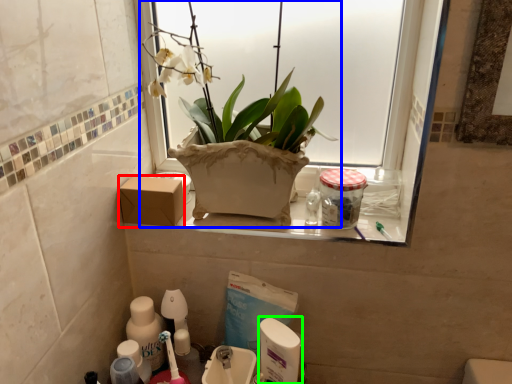
Question: Which is farther away from cardboard box (highlighted by a red box)? houseplant (highlighted by a blue box) or cleaning product (highlighted by a green box)?

Choices:
 (A) houseplant
 (B) cleaning product

Answer: (B)